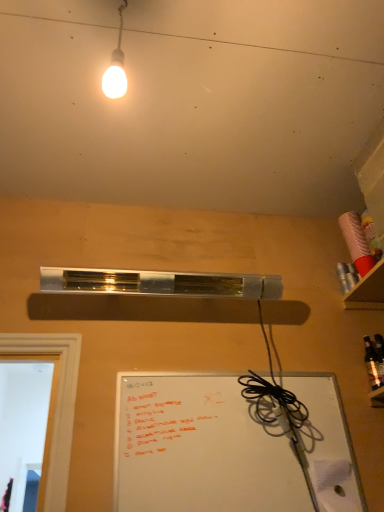
Question: Considering the relative positions of cardboard shelf at upper right and shiny dark glass bottle at right in the image provided, is cardboard shelf at upper right to the right of shiny dark glass bottle at right from the viewer's perspective?

Choices:
 (A) yes
 (B) no

Answer: (A)

Question: From a real-world perspective, is cardboard shelf at upper right below shiny dark glass bottle at right?

Choices:
 (A) yes
 (B) no

Answer: (B)

Question: Are cardboard shelf at upper right and shiny dark glass bottle at right far apart?

Choices:
 (A) no
 (B) yes

Answer: (A)

Question: Is cardboard shelf at upper right oriented away from shiny dark glass bottle at right?

Choices:
 (A) no
 (B) yes

Answer: (A)

Question: Is the depth of cardboard shelf at upper right less than that of shiny dark glass bottle at right?

Choices:
 (A) yes
 (B) no

Answer: (A)

Question: Does point (107, 71) appear closer or farther from the camera than point (355, 306)?

Choices:
 (A) farther
 (B) closer

Answer: (B)

Question: In terms of height, does matte white bulb at upper center look taller or shorter compared to cardboard shelf at upper right?

Choices:
 (A) short
 (B) tall

Answer: (B)

Question: Would you say matte white bulb at upper center is inside or outside cardboard shelf at upper right?

Choices:
 (A) outside
 (B) inside

Answer: (A)

Question: Considering their positions, is matte white bulb at upper center located in front of or behind cardboard shelf at upper right?

Choices:
 (A) front
 (B) behind

Answer: (A)

Question: Is matte white bulb at upper center to the left or to the right of shiny dark glass bottle at right in the image?

Choices:
 (A) left
 (B) right

Answer: (A)

Question: Would you say matte white bulb at upper center is inside or outside shiny dark glass bottle at right?

Choices:
 (A) inside
 (B) outside

Answer: (B)

Question: Relative to shiny dark glass bottle at right, is matte white bulb at upper center in front or behind?

Choices:
 (A) front
 (B) behind

Answer: (A)

Question: Is matte white bulb at upper center taller or shorter than shiny dark glass bottle at right?

Choices:
 (A) tall
 (B) short

Answer: (A)

Question: From the image's perspective, relative to shiny dark glass bottle at right, is cardboard shelf at upper right above or below?

Choices:
 (A) above
 (B) below

Answer: (A)

Question: From a real-world perspective, relative to shiny dark glass bottle at right, is cardboard shelf at upper right vertically above or below?

Choices:
 (A) above
 (B) below

Answer: (A)